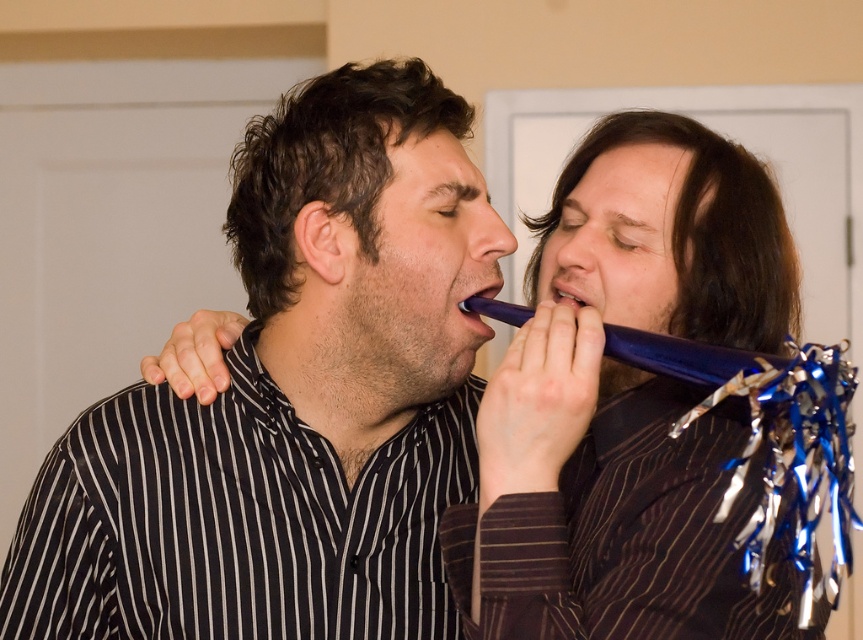
Question: Among these points, which one is farthest from the camera?

Choices:
 (A) (671, 371)
 (B) (654, 148)
 (C) (565, 284)

Answer: (B)

Question: Does matte blue plastic toothbrush at upper right appear on the left side of blue shiny plastic mouth at center?

Choices:
 (A) no
 (B) yes

Answer: (A)

Question: Is shiny blue plastic horn at center bigger than blue shiny plastic mouth at center?

Choices:
 (A) no
 (B) yes

Answer: (B)

Question: Which point is farther to the camera?

Choices:
 (A) blue shiny plastic mouth at center
 (B) shiny blue plastic horn at center

Answer: (A)

Question: Is the position of matte blue plastic toothbrush at upper right less distant than that of blue shiny plastic mouth at center?

Choices:
 (A) yes
 (B) no

Answer: (A)

Question: Based on their relative distances, which object is nearer to the shiny blue plastic horn at center?

Choices:
 (A) matte blue plastic toothbrush at upper right
 (B) matte black shirt at left
 (C) blue shiny plastic mouth at center

Answer: (A)